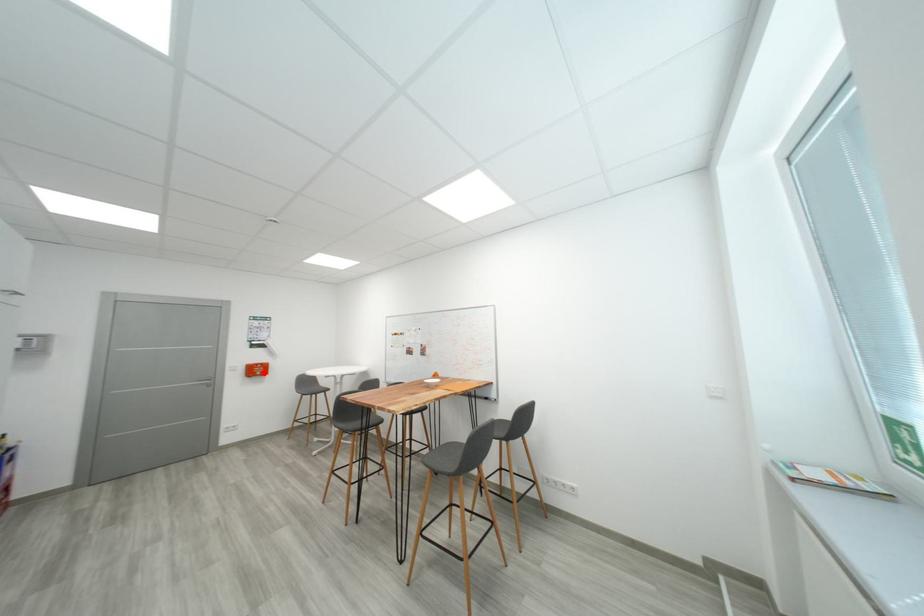
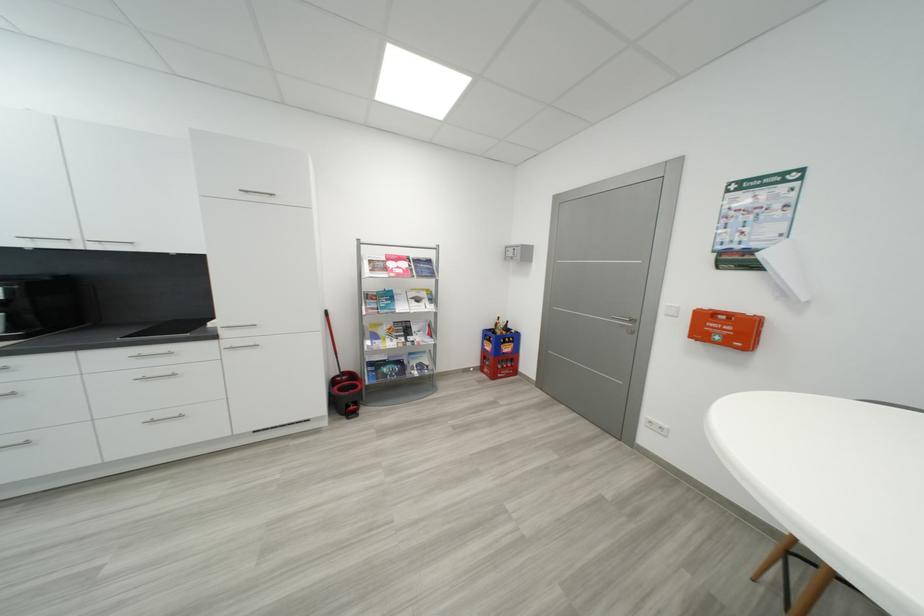
In the second image, find the point that corresponds to the highlighted location in the first image.

(733, 333)